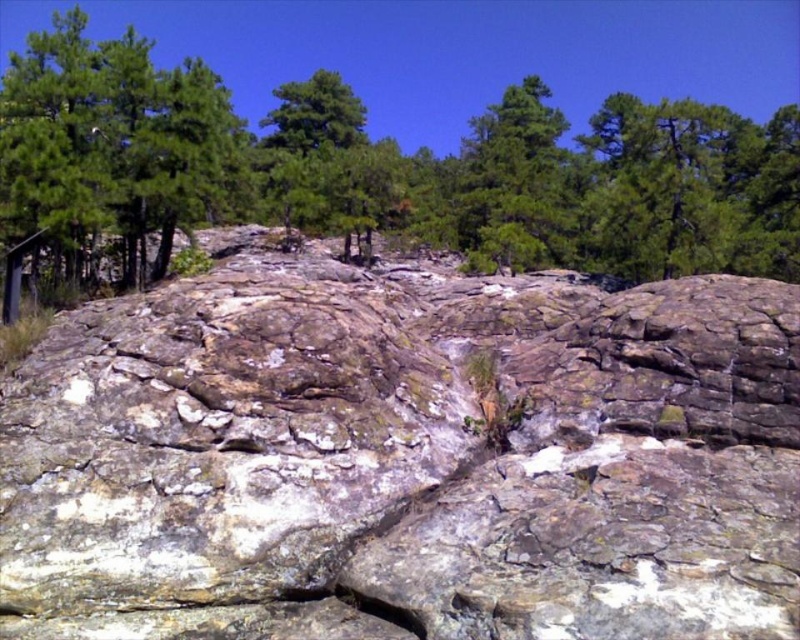
Question: Which of the following is the closest to the observer?

Choices:
 (A) green leafy tree at upper center
 (B) rocky surface at center
 (C) green textured tree at left

Answer: (B)

Question: Which of the following is the closest to the observer?

Choices:
 (A) (376, 312)
 (B) (798, 246)

Answer: (A)

Question: Observing the image, what is the correct spatial positioning of rocky surface at center in reference to green textured tree at left?

Choices:
 (A) right
 (B) left

Answer: (A)

Question: Among these objects, which one is nearest to the camera?

Choices:
 (A) rocky surface at center
 (B) green textured tree at left
 (C) green leafy tree at upper center

Answer: (A)

Question: Is green leafy tree at upper center to the right of green textured tree at left from the viewer's perspective?

Choices:
 (A) no
 (B) yes

Answer: (B)

Question: Can you confirm if rocky surface at center is positioned above green textured tree at left?

Choices:
 (A) yes
 (B) no

Answer: (B)